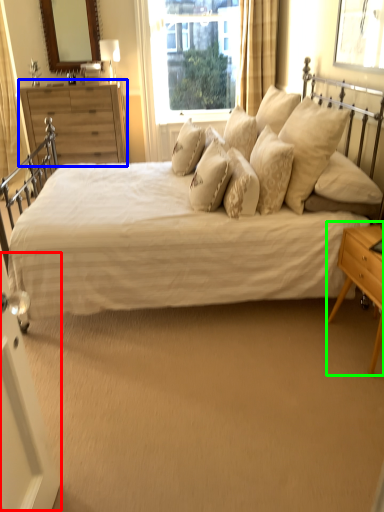
Question: Considering the real-world distances, which object is closest to screen door (highlighted by a red box)? chest of drawers (highlighted by a blue box) or nightstand (highlighted by a green box).

Choices:
 (A) chest of drawers
 (B) nightstand

Answer: (B)